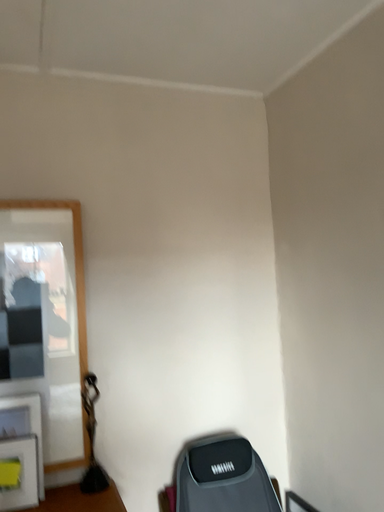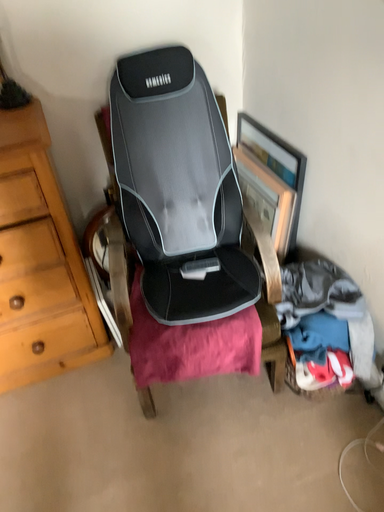
Question: How did the camera likely rotate when shooting the video?

Choices:
 (A) rotated upward
 (B) rotated downward

Answer: (B)